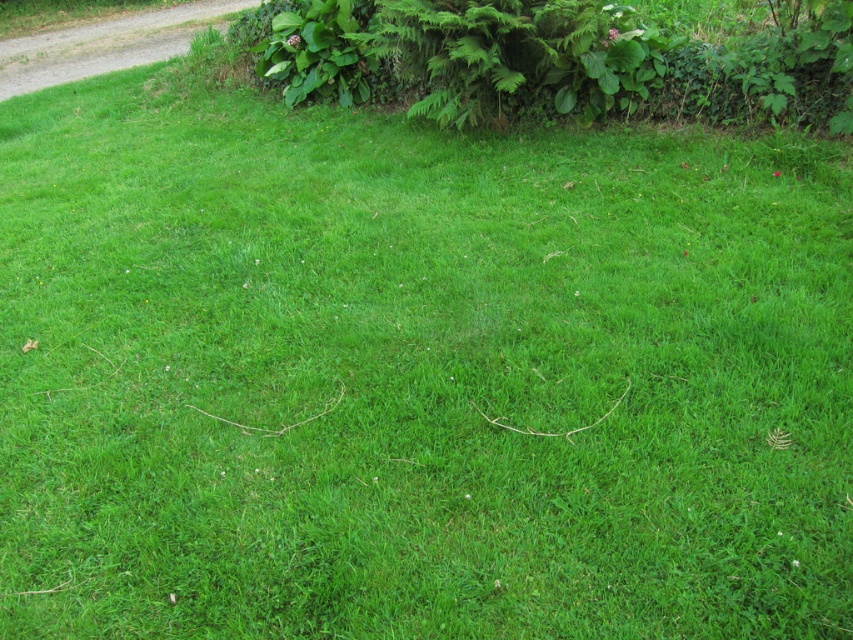
You are standing in a garden and want to take a photo of the green leafy hedge at upper center. If your camera can focus on objects up to 5 meters away, will you need to move closer to get a clear shot?

The green leafy hedge at upper center is 5.16 meters from viewer. Since the camera can only focus up to 5 meters, you need to move closer to ensure the hedge is within the focus range.

You are a gardener who needs to trim the green leafy hedge at upper center and the gravel at upper left. Which object requires less trimming because it is shorter?

The green leafy hedge at upper center requires less trimming because it is not as tall as the gravel at upper left.

You are a gardener planning to plant a new row of flowers between the green leafy hedge at upper center and the gravel at upper left. Based on their positions, which object should you start digging near first?

The green leafy hedge at upper center is below the gravel at upper left, so you should start digging near the gravel at upper left first since it is higher up and closer to the starting point.